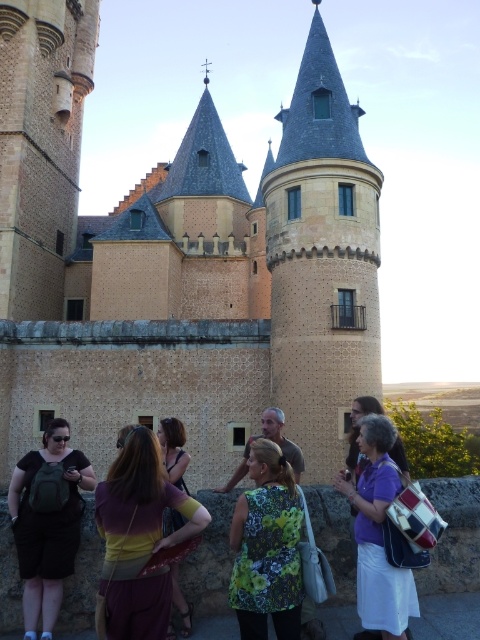
You are a photographer trying to capture a candid shot of the group in front of the historic castle. You notice two people wearing floral patterns. One is wearing a floral fabric vest at center and the other has a floral print shirt at center. Since you want to ensure both are visible in the frame, which clothing item would you focus on to make sure the taller one is fully in the shot?

The floral print shirt at center is taller than the floral fabric vest at center. To ensure the taller one is fully in the shot, focus on the floral print shirt at center.

You are standing in front of the historic castle structure and want to take a photo of a specific point located at coordinates point (133,616). The camera you are using has a maximum focus range of 25 meters. Will the camera be able to focus on the point?

The distance of point (133,616) from the camera is 26.27 meters, which exceeds the camera maximum focus range of 25 meters. So the camera will not be able to focus on the point.

You are a photographer standing at the camera position. You want to take a photo of the maroon fabric dress at center. Considering the distance, can you clearly capture the details of the dress without zooming in?

The maroon fabric dress at center is 25.56 meters away from the camera. At this distance, capturing clear details without zooming in may be challenging due to the limited resolution and depth of field, so it is recommended to use zoom to ensure clarity.